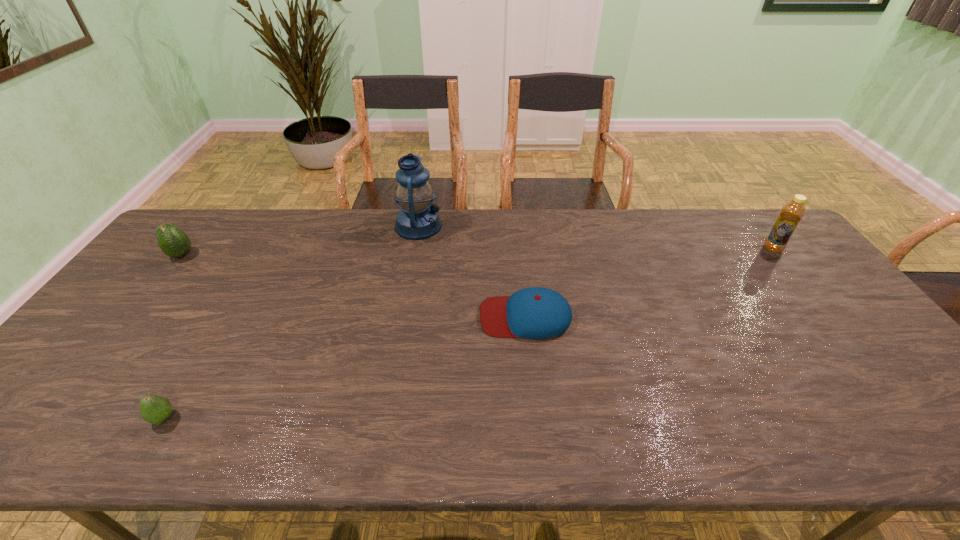
Point out which object is positioned as the nearest to the lantern. Please provide its 2D coordinates. Your answer should be formatted as a tuple, i.e. [(x, y)], where the tuple contains the x and y coordinates of a point satisfying the conditions above.

[(536, 312)]

The image size is (960, 540). Find the location of `free space that satisfies the following two spatial constraints: 1. on the face of the bottle; 2. on the right side of the lantern`. free space that satisfies the following two spatial constraints: 1. on the face of the bottle; 2. on the right side of the lantern is located at coordinates (414, 249).

This screenshot has width=960, height=540. Find the location of `vacant point that satisfies the following two spatial constraints: 1. on the back side of the rightmost object; 2. on the face of the third object from right to left`. vacant point that satisfies the following two spatial constraints: 1. on the back side of the rightmost object; 2. on the face of the third object from right to left is located at coordinates (755, 226).

Find the location of a particular element. free space that satisfies the following two spatial constraints: 1. on the face of the tallest object; 2. on the left side of the rightmost object is located at coordinates (414, 249).

Locate an element on the screen. The height and width of the screenshot is (540, 960). vacant position in the image that satisfies the following two spatial constraints: 1. on the face of the bottle; 2. on the right side of the lantern is located at coordinates (414, 249).